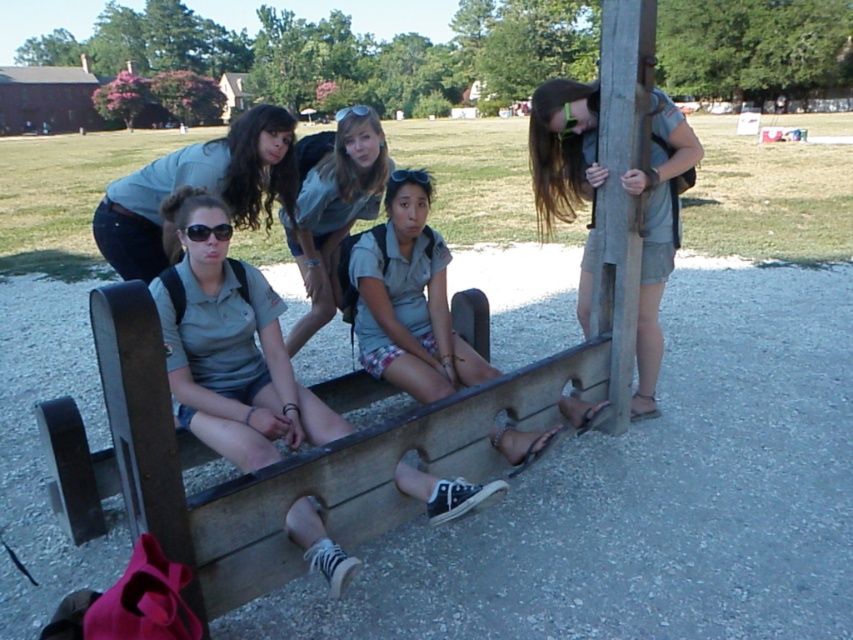
Question: Which object appears closest to the camera in this image?

Choices:
 (A) wooden post at right
 (B) matte gray shirt at center

Answer: (A)

Question: Which point is farther from the camera taking this photo?

Choices:
 (A) (200, 227)
 (B) (668, 259)

Answer: (B)

Question: Is the position of gray fabric shirt at center less distant than that of wooden post at right?

Choices:
 (A) no
 (B) yes

Answer: (B)

Question: Among these points, which one is farthest from the camera?

Choices:
 (A) (120, 234)
 (B) (595, 227)

Answer: (B)

Question: From the image, what is the correct spatial relationship of light gray uniform at center in relation to wooden post at right?

Choices:
 (A) above
 (B) below

Answer: (B)

Question: Does wooden post at right appear on the right side of matte gray shirt at upper left?

Choices:
 (A) no
 (B) yes

Answer: (B)